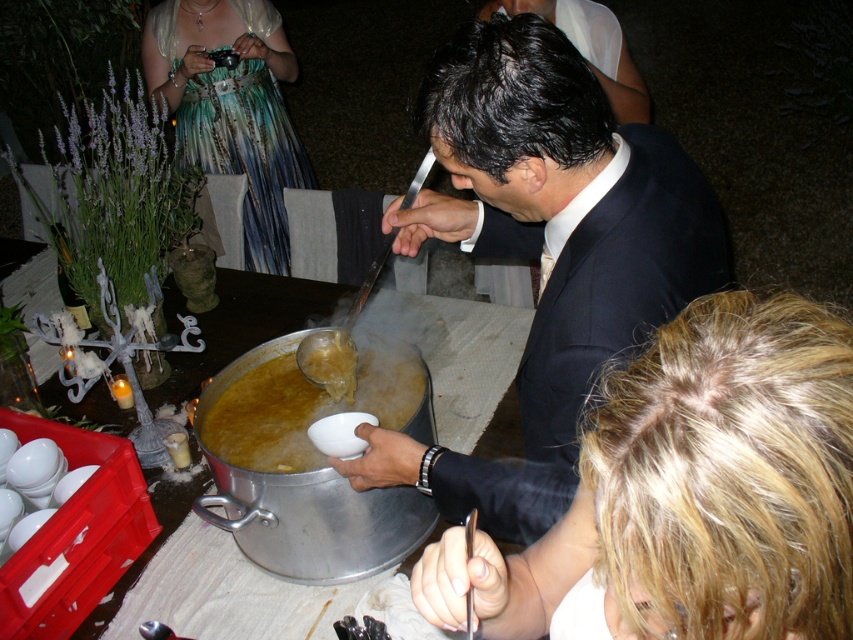
Does blonde hair at lower right have a greater width compared to golden brown broth at center?

No, blonde hair at lower right is not wider than golden brown broth at center.

Which is above, blonde hair at lower right or golden brown broth at center?

golden brown broth at center is above.

Is point (680, 326) closer to viewer compared to point (376, 397)?

Yes, point (680, 326) is closer to viewer.

This screenshot has width=853, height=640. In order to click on blonde hair at lower right in this screenshot , I will do [x=692, y=490].

Which is more to the left, blonde hair at lower right or shiny black suit at center?

shiny black suit at center is more to the left.

This screenshot has height=640, width=853. I want to click on blonde hair at lower right, so click(x=692, y=490).

Image resolution: width=853 pixels, height=640 pixels. Find the location of `blonde hair at lower right`. blonde hair at lower right is located at coordinates (692, 490).

Which is below, shiny black suit at center or shiny teal dress at upper left?

shiny black suit at center is lower down.

Consider the image. Is shiny black suit at center shorter than shiny teal dress at upper left?

Yes, shiny black suit at center is shorter than shiny teal dress at upper left.

Who is more distant from viewer, (442, 108) or (245, 240)?

Point (245, 240)

In order to click on shiny black suit at center in this screenshot , I will do `click(546, 252)`.